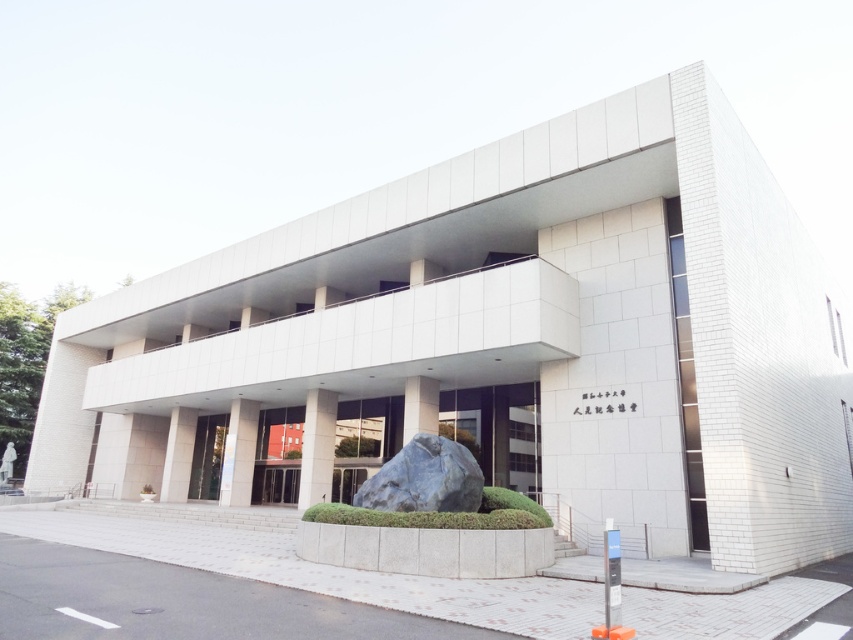
Question: Can you confirm if glass door at center is wider than glossy glass door at center?

Choices:
 (A) no
 (B) yes

Answer: (B)

Question: Is white glass door at center smaller than glossy glass door at center?

Choices:
 (A) no
 (B) yes

Answer: (B)

Question: Which object is farther from the camera taking this photo?

Choices:
 (A) white glass door at center
 (B) glass door at center
 (C) smooth glass door at center
 (D) glossy glass door at center

Answer: (D)

Question: Which point is farther to the camera?

Choices:
 (A) (689, 460)
 (B) (491, 449)
 (C) (277, 436)

Answer: (C)

Question: Among these points, which one is nearest to the camera?

Choices:
 (A) (252, 484)
 (B) (682, 317)
 (C) (445, 417)

Answer: (B)

Question: Is smooth glass door at center to the right of white glass door at center from the viewer's perspective?

Choices:
 (A) no
 (B) yes

Answer: (A)